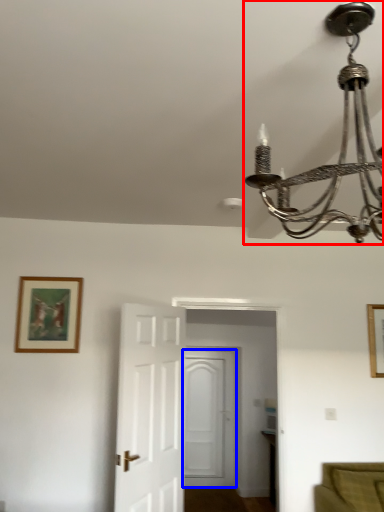
Question: Which object is further to the camera taking this photo, lamp (highlighted by a red box) or door (highlighted by a blue box)?

Choices:
 (A) lamp
 (B) door

Answer: (B)